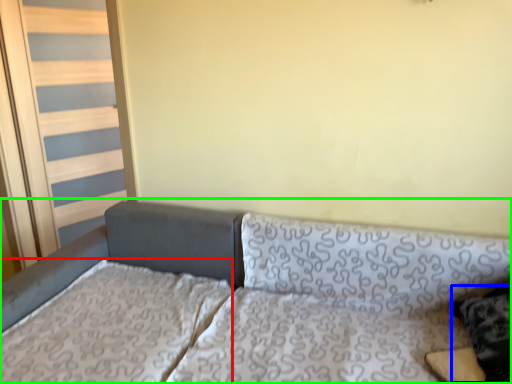
Question: Estimate the real-world distances between objects in this image. Which object is closer to mattress (highlighted by a red box), pillow (highlighted by a blue box) or studio couch (highlighted by a green box)?

Choices:
 (A) pillow
 (B) studio couch

Answer: (B)